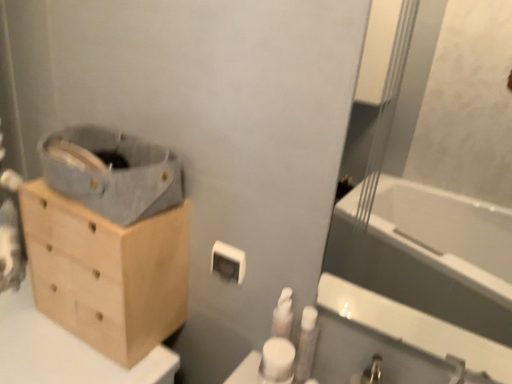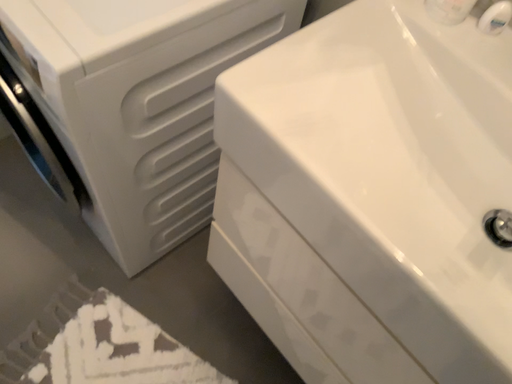
Question: How did the camera likely rotate when shooting the video?

Choices:
 (A) rotated left
 (B) rotated right

Answer: (A)